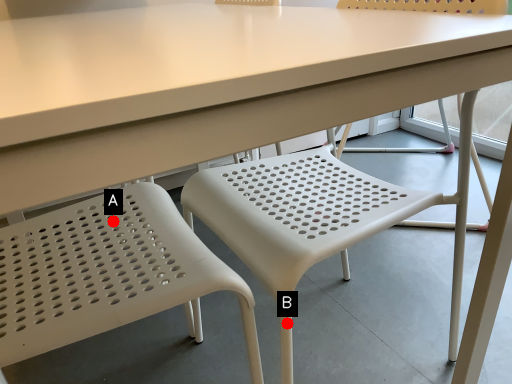
Question: Two points are circled on the image, labeled by A and B beside each circle. Among these points, which one is nearest to the camera?

Choices:
 (A) A is closer
 (B) B is closer

Answer: (B)